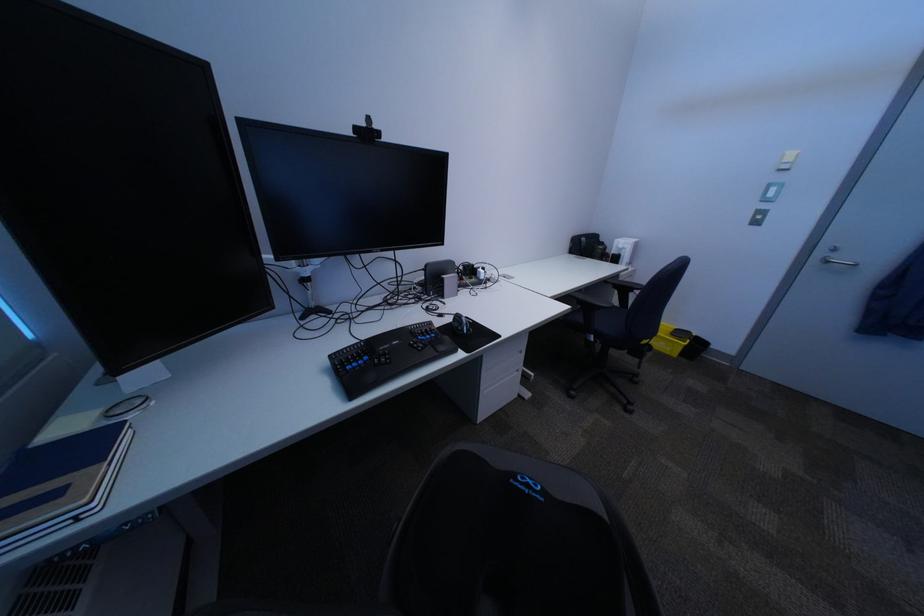
Describe the element at coordinates (624, 290) in the screenshot. I see `the black chair armrest` at that location.